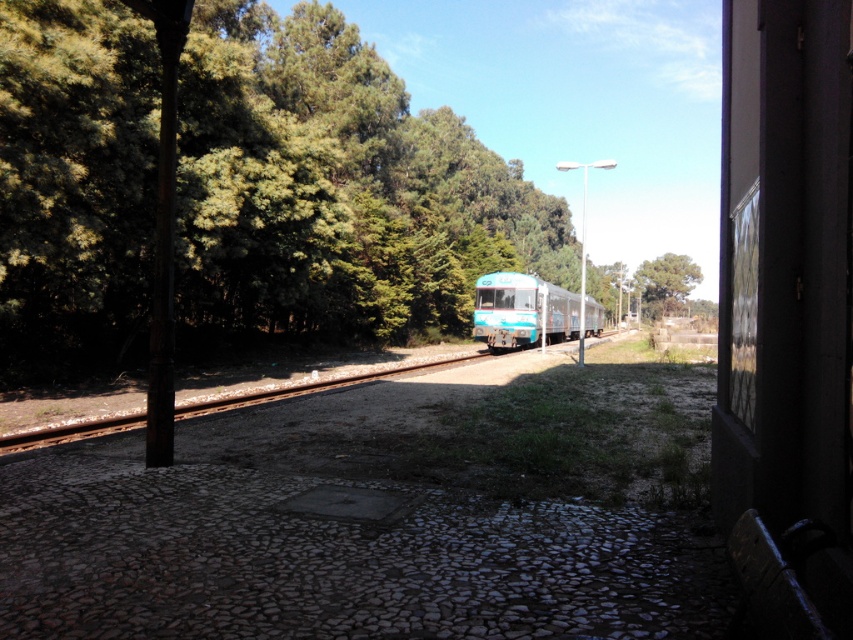
Can you confirm if green leafy trees at upper left is positioned to the left of green leafy tree at center?

Yes, green leafy trees at upper left is to the left of green leafy tree at center.

Measure the distance between point (x=132, y=200) and camera.

17.72 meters

Where is `green leafy trees at upper left`? Image resolution: width=853 pixels, height=640 pixels. green leafy trees at upper left is located at coordinates (335, 189).

Does teal glossy train at center appear under green leafy tree at center?

Yes, teal glossy train at center is below green leafy tree at center.

Can you confirm if teal glossy train at center is positioned above green leafy tree at center?

Incorrect, teal glossy train at center is not positioned above green leafy tree at center.

Does point (490, 305) come closer to viewer compared to point (662, 289)?

Yes, point (490, 305) is in front of point (662, 289).

Where is `teal glossy train at center`? This screenshot has height=640, width=853. teal glossy train at center is located at coordinates pos(523,310).

Does green leafy trees at upper left appear over teal glossy train at center?

Yes, green leafy trees at upper left is above teal glossy train at center.

In the scene shown: Who is positioned more to the left, green leafy trees at upper left or teal glossy train at center?

Positioned to the left is green leafy trees at upper left.

Between point (274, 29) and point (552, 300), which one is positioned in front?

Point (274, 29) is more forward.

Locate an element on the screen. This screenshot has height=640, width=853. green leafy trees at upper left is located at coordinates (335, 189).